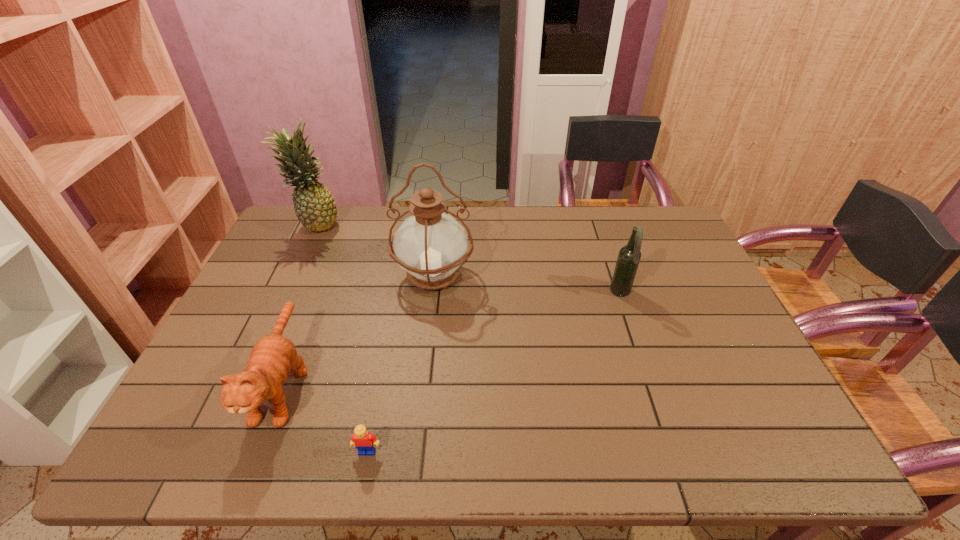
Find the location of a particular element. Image resolution: width=960 pixels, height=540 pixels. oil lamp is located at coordinates (431, 246).

I want to click on the farthest object, so click(314, 205).

Locate an element on the screen. beer bottle is located at coordinates (629, 256).

Find the location of `the third tallest object`. the third tallest object is located at coordinates (629, 256).

At what (x,y) coordinates should I click in order to perform the action: click on the second shortest object. Please return your answer as a coordinate pair (x, y). Looking at the image, I should click on (272, 358).

The image size is (960, 540). I want to click on the shortest object, so click(362, 439).

At what (x,y) coordinates should I click in order to perform the action: click on vacant space located 0.310m on the right of the oil lamp. Please return your answer as a coordinate pair (x, y). This screenshot has width=960, height=540. Looking at the image, I should click on (574, 275).

Where is `free space located on the right of the pineapple`? The width and height of the screenshot is (960, 540). free space located on the right of the pineapple is located at coordinates (366, 225).

The height and width of the screenshot is (540, 960). Find the location of `vacant space positioned on the back of the third tallest object`. vacant space positioned on the back of the third tallest object is located at coordinates (613, 273).

Locate an element on the screen. This screenshot has width=960, height=540. object located in the far edge section of the desktop is located at coordinates 314,205.